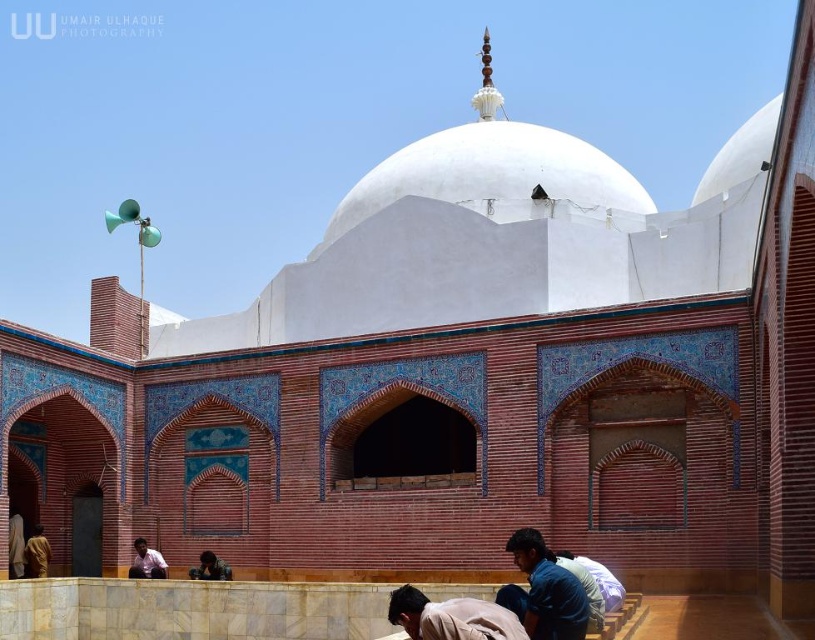
Question: Based on their relative distances, which object is farther from the light brown fabric at lower center?

Choices:
 (A) light brown shirt at lower left
 (B) golden textured robe at lower left
 (C) dark brown leather jacket at lower center

Answer: (C)

Question: Which object is the closest to the light brown fabric at lower center?

Choices:
 (A) light brown shirt at lower left
 (B) dark brown leather jacket at lower center

Answer: (A)

Question: Among these points, which one is farthest from the camera?

Choices:
 (A) (496, 604)
 (B) (522, 556)
 (C) (153, 564)
 (D) (206, 552)

Answer: (D)

Question: Does blue fabric at lower center lie behind light brown shirt at lower left?

Choices:
 (A) yes
 (B) no

Answer: (B)

Question: From the image, what is the correct spatial relationship of light brown fabric at lower center in relation to golden textured robe at lower left?

Choices:
 (A) left
 (B) right

Answer: (B)

Question: Is golden textured robe at lower left to the left of dark brown leather jacket at lower center from the viewer's perspective?

Choices:
 (A) no
 (B) yes

Answer: (B)